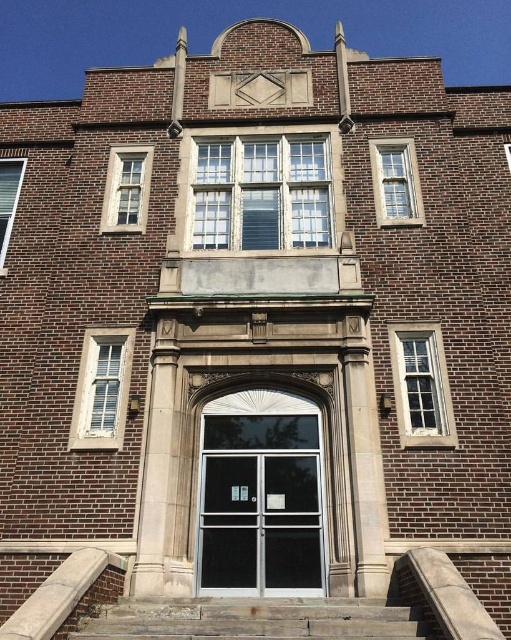
You are an architect evaluating the building facade. You need to determine which of the clear glass windows at center or the clear glass window at right has a larger area based on their spatial occupation. Which one do you think is larger?

The clear glass window at right is larger because the clear glass windows at center occupies less space than clear glass window at right.

You are a maintenance worker needing to replace the glass in the clear glass windows at center and the clear glass window at upper center. You have a ladder that can reach up to 12 feet. Can you safely reach both windows with your current ladder?

The distance between the clear glass windows at center and the clear glass window at upper center is 13.53 feet. Since the ladder can only reach up to 12 feet, you cannot safely reach the clear glass window at upper center with your current ladder.